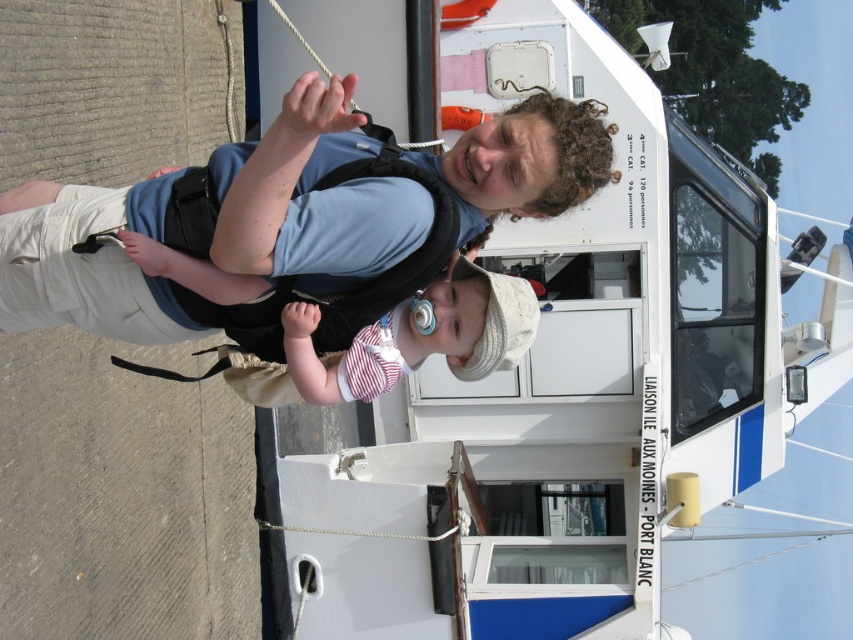
Does blue fabric vest at center have a greater height compared to white cotton hat at center?

Yes.

Is point (473, 147) closer to camera compared to point (296, 369)?

Yes, point (473, 147) is in front of point (296, 369).

Image resolution: width=853 pixels, height=640 pixels. Describe the element at coordinates (288, 224) in the screenshot. I see `blue fabric vest at center` at that location.

Where is `blue fabric vest at center`? Image resolution: width=853 pixels, height=640 pixels. blue fabric vest at center is located at coordinates (288, 224).